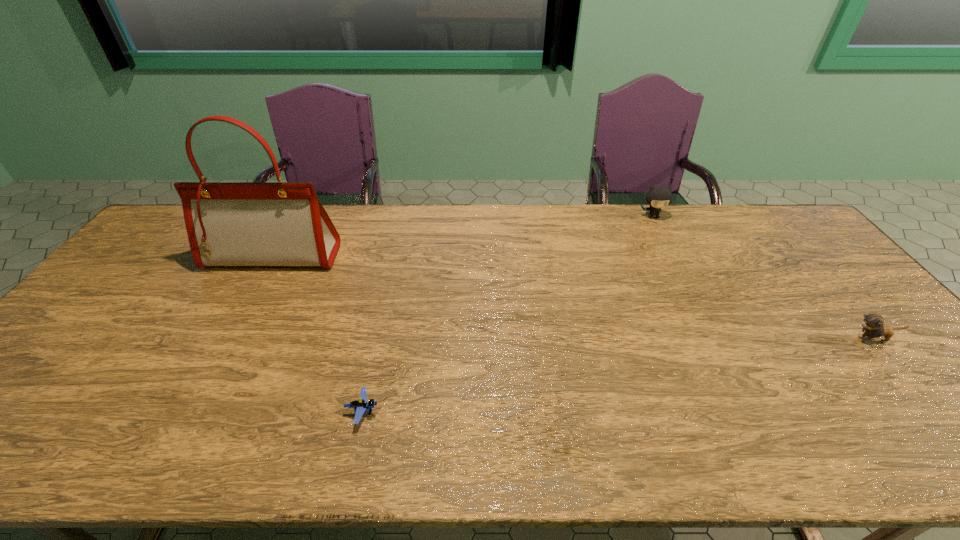
The image size is (960, 540). I want to click on free region located on the front-facing side of the right kitten, so [763, 339].

Locate an element on the screen. This screenshot has height=540, width=960. free point located on the front-facing side of the right kitten is located at coordinates (740, 339).

Locate an element on the screen. The width and height of the screenshot is (960, 540). vacant space situated on the front-facing side of the right kitten is located at coordinates click(771, 339).

At what (x,y) coordinates should I click in order to perform the action: click on vacant space located on the front-facing side of the second object from left to right. Please return your answer as a coordinate pair (x, y). Looking at the image, I should click on (460, 411).

Locate an element on the screen. This screenshot has height=540, width=960. handbag situated at the far edge is located at coordinates (241, 224).

Find the location of a particular element. This screenshot has width=960, height=540. kitten at the far edge is located at coordinates (657, 197).

In order to click on object located in the near edge section of the desktop in this screenshot , I will do `click(360, 406)`.

Locate an element on the screen. The image size is (960, 540). object that is at the right edge is located at coordinates (873, 325).

Where is `vacant space at the far edge of the desktop`? This screenshot has height=540, width=960. vacant space at the far edge of the desktop is located at coordinates (564, 206).

Where is `vacant space at the near edge of the desktop`? Image resolution: width=960 pixels, height=540 pixels. vacant space at the near edge of the desktop is located at coordinates (739, 449).